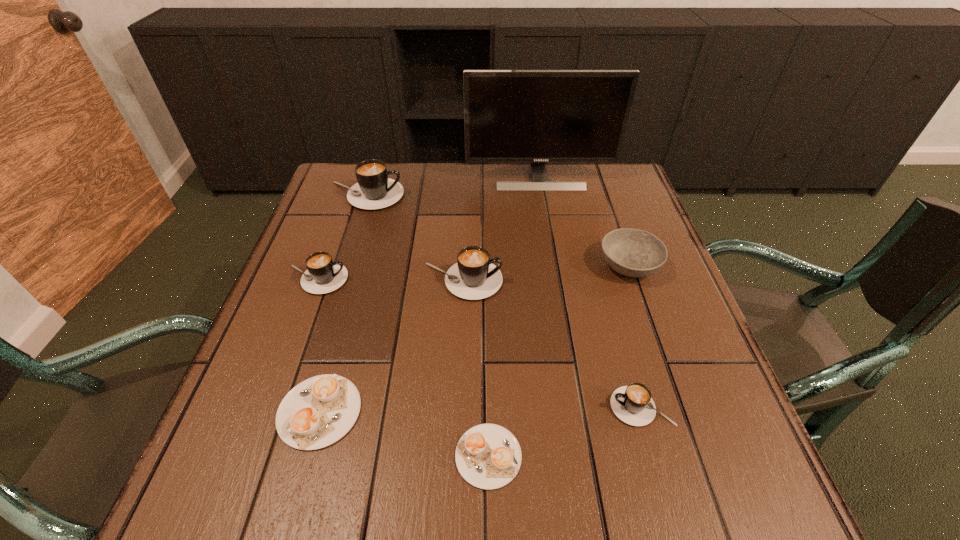
The image size is (960, 540). What are the coordinates of `the left white cappuccino` in the screenshot? It's located at (319, 411).

At what (x,y) coordinates should I click in order to perform the action: click on the shortest cappuccino. Please return your answer as a coordinate pair (x, y). Image resolution: width=960 pixels, height=540 pixels. Looking at the image, I should click on (488, 456).

Find the location of a particular element. the smaller white cappuccino is located at coordinates click(x=488, y=456).

This screenshot has height=540, width=960. Identify the location of vacant region located 0.350m on the screen side of the monitor. (557, 278).

Where is `vacant region located with the handle on the side of the second tallest object`? The height and width of the screenshot is (540, 960). vacant region located with the handle on the side of the second tallest object is located at coordinates (471, 195).

What are the coordinates of `vacant space located with the handle on the side of the fifth shortest cappuccino` in the screenshot? It's located at (660, 281).

Locate an element on the screen. The width and height of the screenshot is (960, 540). blank area located 0.340m with the handle on the side of the third tallest cappuccino is located at coordinates (496, 279).

Find the location of a particular element. vacant space located 0.240m on the front of the bowl is located at coordinates (668, 381).

Find the location of a particular element. The image size is (960, 540). free spot located 0.240m with the handle on the side of the nearest black cappuccino is located at coordinates (475, 407).

Where is `vacant space located 0.330m with the handle on the side of the nearest black cappuccino`? This screenshot has height=540, width=960. vacant space located 0.330m with the handle on the side of the nearest black cappuccino is located at coordinates (424, 407).